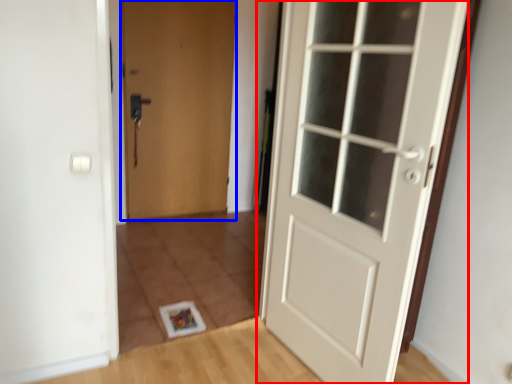
Question: Which point is further to the camera, door (highlighted by a red box) or door (highlighted by a blue box)?

Choices:
 (A) door
 (B) door

Answer: (B)